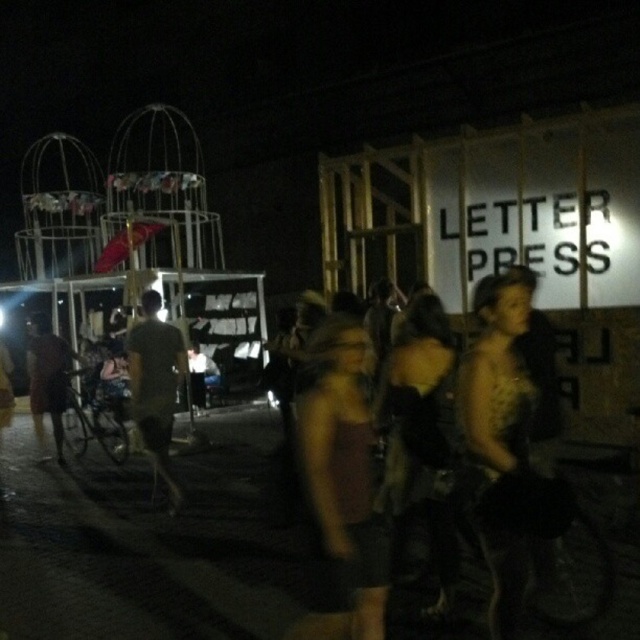
You are standing at the point labeled point (129, 362) and want to walk towards the point labeled point (54, 385). Which direction should you move to get closer to your destination?

You should move downward because point (129, 362) is closer to the viewer than point (54, 385), so moving downward would take you towards the destination.

What is located at the coordinates point (339,486)?

The point (339,486) has a matte brown dress at center.